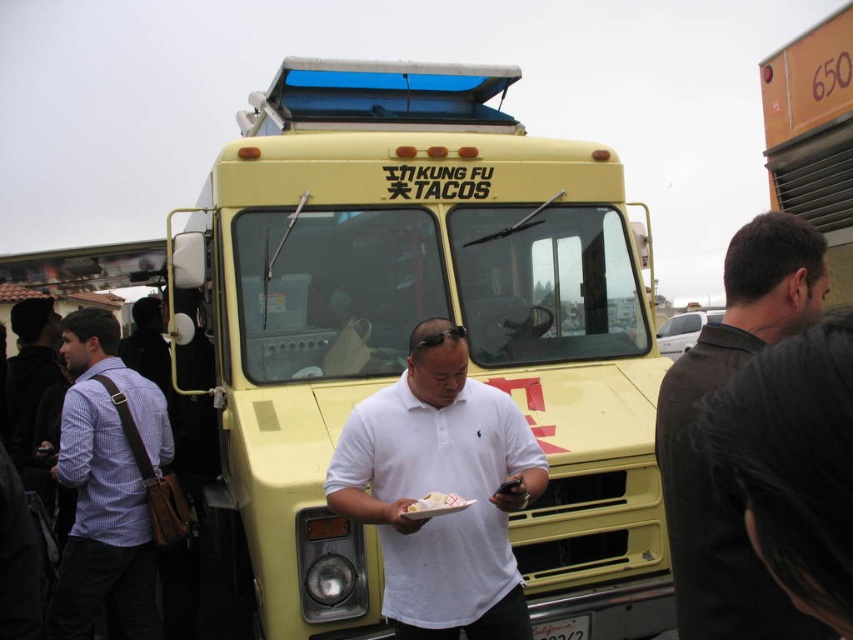
Who is positioned more to the left, yellow matte food truck at center or white paper plate at center?

yellow matte food truck at center

The height and width of the screenshot is (640, 853). What do you see at coordinates (410, 328) in the screenshot?
I see `yellow matte food truck at center` at bounding box center [410, 328].

Locate an element on the screen. The image size is (853, 640). yellow matte food truck at center is located at coordinates (410, 328).

Between dark brown leather jacket at right and yellow plastic food truck at upper right, which one appears on the right side from the viewer's perspective?

yellow plastic food truck at upper right

Is the position of dark brown leather jacket at right more distant than that of yellow plastic food truck at upper right?

No, it is in front of yellow plastic food truck at upper right.

Locate an element on the screen. The height and width of the screenshot is (640, 853). dark brown leather jacket at right is located at coordinates (706, 458).

This screenshot has height=640, width=853. Identify the location of yellow plastic food truck at upper right. (813, 134).

Is yellow plastic food truck at upper right positioned behind white paper plate at center?

Yes, yellow plastic food truck at upper right is behind white paper plate at center.

Where is `yellow plastic food truck at upper right`? The width and height of the screenshot is (853, 640). yellow plastic food truck at upper right is located at coordinates (813, 134).